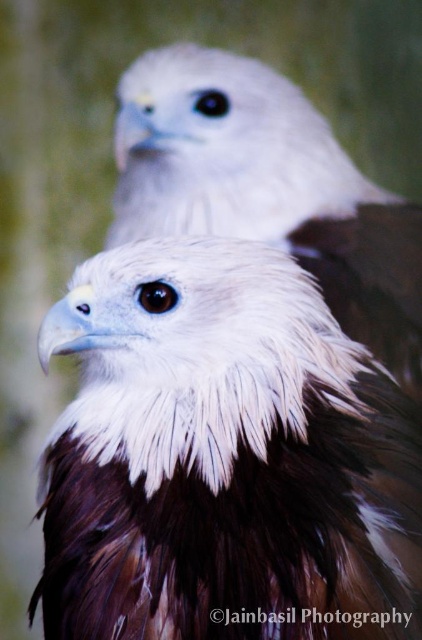
Which is below, white feathered eagle at center or white fluffy eagle at upper center?

white feathered eagle at center is lower down.

Who is higher up, white feathered eagle at center or white fluffy eagle at upper center?

white fluffy eagle at upper center is above.

What do you see at coordinates (224, 458) in the screenshot?
I see `white feathered eagle at center` at bounding box center [224, 458].

Find the location of a particular element. white feathered eagle at center is located at coordinates (224, 458).